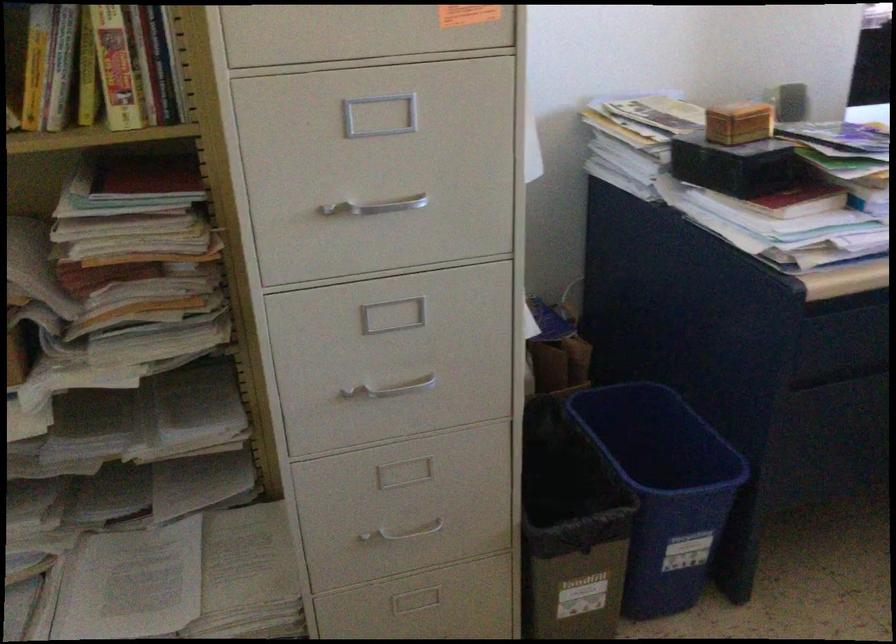
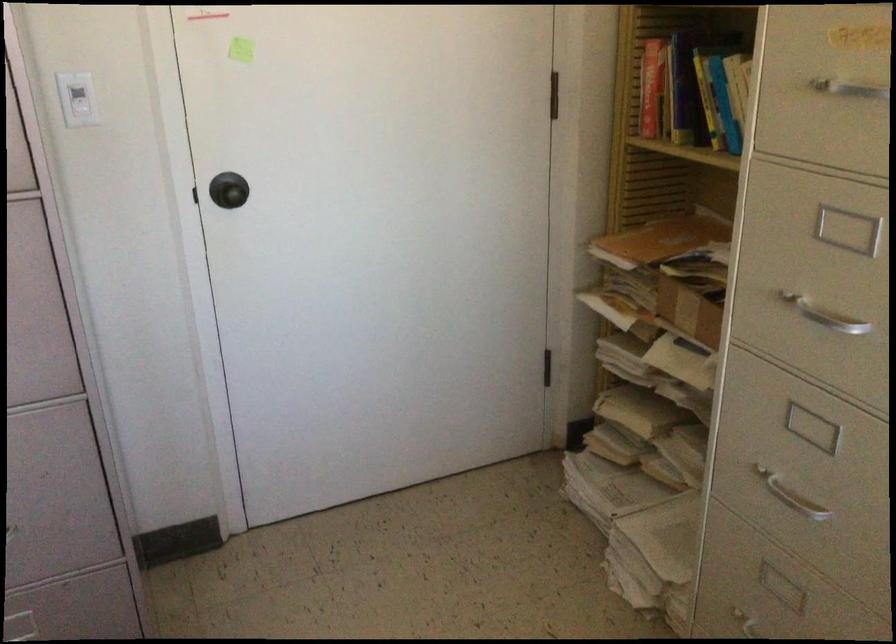
The point at (376, 200) is marked in the first image. Where is the corresponding point in the second image?

(824, 315)